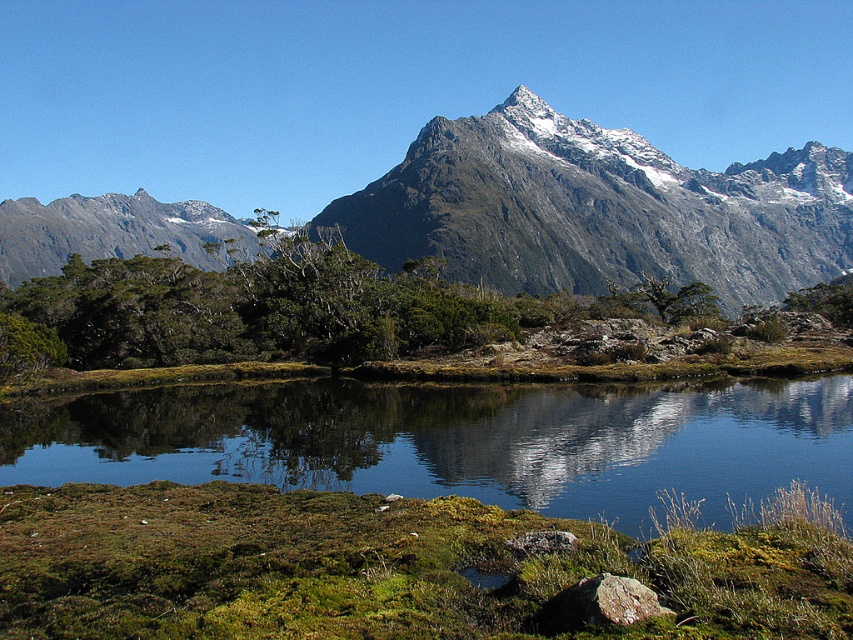
Image resolution: width=853 pixels, height=640 pixels. Describe the element at coordinates (300, 307) in the screenshot. I see `green leafy shrub at center` at that location.

The height and width of the screenshot is (640, 853). Find the location of `green leafy shrub at center`. green leafy shrub at center is located at coordinates (300, 307).

Between clear water at center and rugged granite mountain range at upper center, which one appears on the left side from the viewer's perspective?

Positioned to the left is clear water at center.

Can you confirm if clear water at center is smaller than rugged granite mountain range at upper center?

Correct, clear water at center occupies less space than rugged granite mountain range at upper center.

Is point (555, 480) in front of point (701, 196)?

That is True.

I want to click on clear water at center, so (456, 442).

Between clear water at center and green leafy shrub at center, which one has less height?

Standing shorter between the two is clear water at center.

Is point (10, 472) closer to camera compared to point (218, 355)?

That is True.

Does point (274, 404) come behind point (149, 358)?

No, (274, 404) is closer to viewer.

Identify the location of clear water at center. (456, 442).